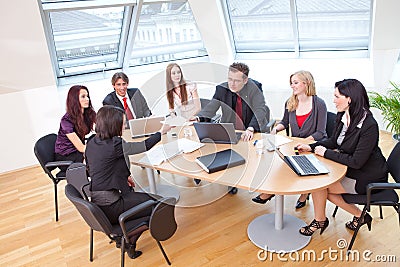
I want to click on table, so coord(282,178).